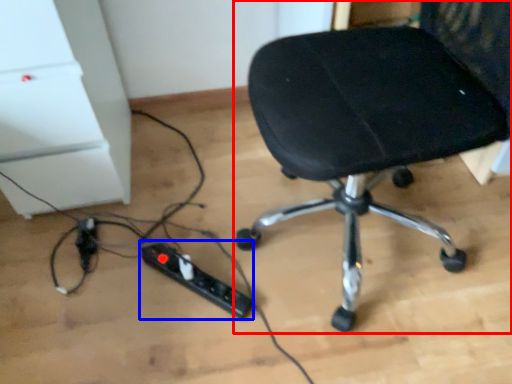
Question: Which point is closer to the camera, chair (highlighted by a red box) or extension cord (highlighted by a blue box)?

Choices:
 (A) chair
 (B) extension cord

Answer: (A)